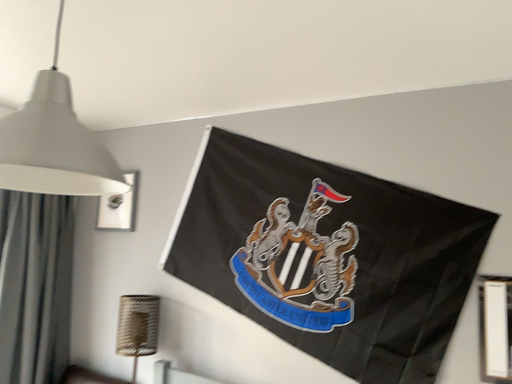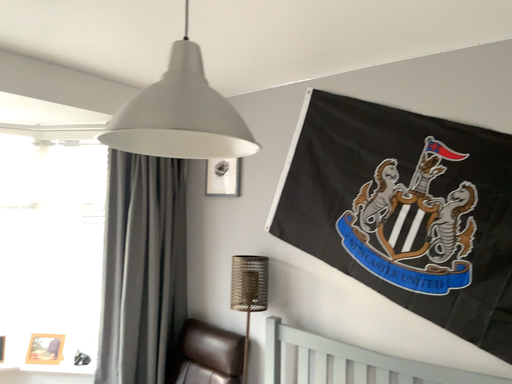
Question: How did the camera likely rotate when shooting the video?

Choices:
 (A) rotated right
 (B) rotated left

Answer: (B)